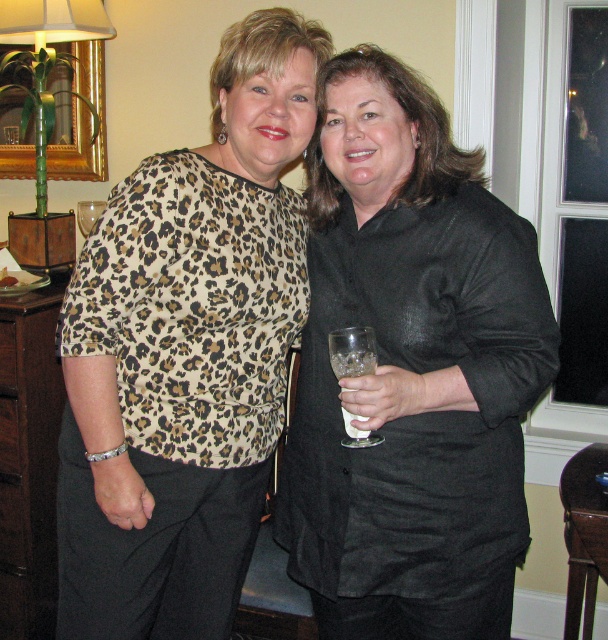
Question: In this image, where is black satin blouse at center located relative to dark wood dresser at left?

Choices:
 (A) above
 (B) below

Answer: (A)

Question: Is leopard print blouse at center positioned before dark wood dresser at left?

Choices:
 (A) no
 (B) yes

Answer: (B)

Question: Can you confirm if clear glass wine glass at right is positioned to the left of transparent glass wine glass at left?

Choices:
 (A) no
 (B) yes

Answer: (A)

Question: Among these points, which one is nearest to the camera?

Choices:
 (A) (83, 228)
 (B) (209, 572)

Answer: (B)

Question: Which object appears closest to the camera in this image?

Choices:
 (A) leopard print blouse at center
 (B) black satin blouse at center
 (C) transparent glass at right

Answer: (B)

Question: Which object is the closest to the leopard print blouse at center?

Choices:
 (A) black satin blouse at center
 (B) transparent glass wine glass at left
 (C) transparent glass at right

Answer: (A)